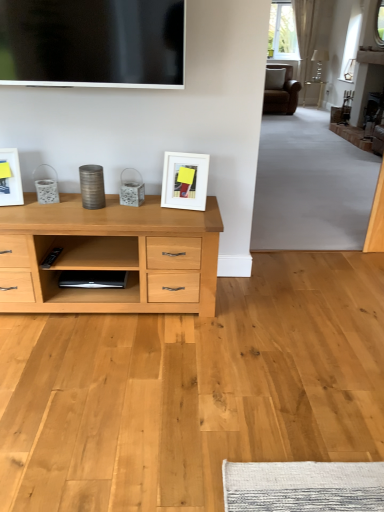
Question: Is the depth of white matte picture frame at center, the first picture frame in the right-to-left sequence, less than that of flat screen tv at upper center?

Choices:
 (A) no
 (B) yes

Answer: (A)

Question: Would you consider white matte picture frame at center, the first picture frame in the right-to-left sequence, to be distant from flat screen tv at upper center?

Choices:
 (A) no
 (B) yes

Answer: (A)

Question: From the image's perspective, is white matte picture frame at center, the first picture frame in the right-to-left sequence, below flat screen tv at upper center?

Choices:
 (A) yes
 (B) no

Answer: (A)

Question: Can you confirm if white matte picture frame at center, acting as the 2th picture frame starting from the left, is bigger than flat screen tv at upper center?

Choices:
 (A) yes
 (B) no

Answer: (B)

Question: Is white matte picture frame at center, acting as the 2th picture frame starting from the left, at the left side of flat screen tv at upper center?

Choices:
 (A) no
 (B) yes

Answer: (A)

Question: Is white matte picture frame at center, acting as the 2th picture frame starting from the left, surrounding flat screen tv at upper center?

Choices:
 (A) yes
 (B) no

Answer: (B)

Question: Is flat screen tv at upper center surrounded by white glossy picture frame at left, positioned as the second picture frame in right-to-left order?

Choices:
 (A) no
 (B) yes

Answer: (A)

Question: Does white glossy picture frame at left, placed as the first picture frame when sorted from left to right, have a larger size compared to flat screen tv at upper center?

Choices:
 (A) yes
 (B) no

Answer: (B)

Question: Can you confirm if white glossy picture frame at left, positioned as the second picture frame in right-to-left order, is positioned to the right of flat screen tv at upper center?

Choices:
 (A) no
 (B) yes

Answer: (A)

Question: From a real-world perspective, is white glossy picture frame at left, placed as the first picture frame when sorted from left to right, over flat screen tv at upper center?

Choices:
 (A) no
 (B) yes

Answer: (A)

Question: From the image's perspective, would you say white glossy picture frame at left, placed as the first picture frame when sorted from left to right, is shown under flat screen tv at upper center?

Choices:
 (A) yes
 (B) no

Answer: (A)

Question: Considering the relative sizes of white glossy picture frame at left, positioned as the second picture frame in right-to-left order, and flat screen tv at upper center in the image provided, is white glossy picture frame at left, positioned as the second picture frame in right-to-left order, wider than flat screen tv at upper center?

Choices:
 (A) yes
 (B) no

Answer: (A)

Question: Can you confirm if flat screen tv at upper center is thinner than white matte picture frame at center, the first picture frame in the right-to-left sequence?

Choices:
 (A) no
 (B) yes

Answer: (B)